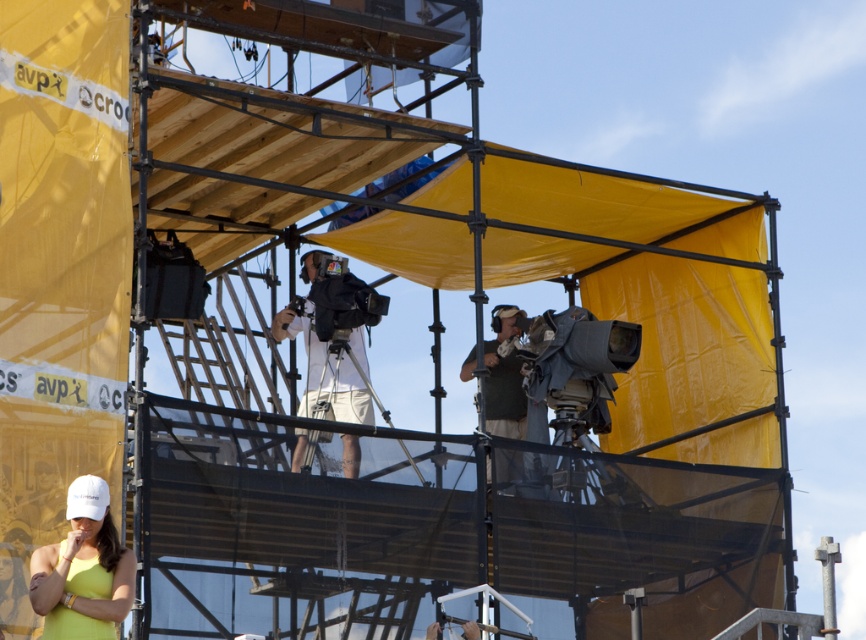
Is white matte camera at center above green fabric vest at center?

Yes.

Does white matte camera at center appear on the right side of green fabric vest at center?

Incorrect, white matte camera at center is not on the right side of green fabric vest at center.

Which is behind, point (285, 314) or point (486, 474)?

Point (285, 314)

You are a GUI agent. You are given a task and a screenshot of the screen. Output one action in this format:
    pyautogui.click(x=<x>, y=<y>)
    Task: Click on the white matte camera at center
    The height and width of the screenshot is (640, 866).
    Given the screenshot: What is the action you would take?
    pyautogui.click(x=305, y=348)

Based on the photo, can you confirm if white matte baseball cap at lower left is taller than green fabric vest at center?

Incorrect, white matte baseball cap at lower left's height is not larger of green fabric vest at center's.

Is white matte baseball cap at lower left wider than green fabric vest at center?

Yes.

Does point (52, 582) come in front of point (522, 472)?

That is True.

Find the location of a particular element. The image size is (866, 640). white matte baseball cap at lower left is located at coordinates (83, 570).

Can you confirm if white matte baseball cap at lower left is bigger than white matte camera at center?

No.

Measure the distance between white matte baseball cap at lower left and white matte camera at center.

white matte baseball cap at lower left is 8.00 meters from white matte camera at center.

Locate an element on the screen. white matte baseball cap at lower left is located at coordinates (83, 570).